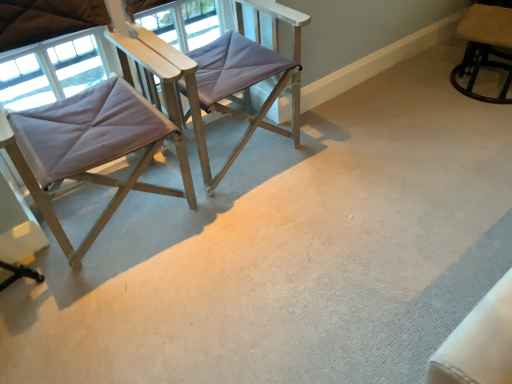
Question: From the image's perspective, is matte purple fabric chair at center, marked as the second chair in a left-to-right arrangement, located beneath beige fabric chair at upper right, which is counted as the 3th chair, starting from the left?

Choices:
 (A) yes
 (B) no

Answer: (A)

Question: Could beige fabric chair at upper right, which is counted as the 3th chair, starting from the left, be considered to be inside matte purple fabric chair at center, marked as the 2th chair in a right-to-left arrangement?

Choices:
 (A) no
 (B) yes

Answer: (A)

Question: From a real-world perspective, does matte purple fabric chair at center, marked as the 2th chair in a right-to-left arrangement, stand above beige fabric chair at upper right, which is counted as the 3th chair, starting from the left?

Choices:
 (A) yes
 (B) no

Answer: (A)

Question: Considering the relative sizes of matte purple fabric chair at center, marked as the 2th chair in a right-to-left arrangement, and beige fabric chair at upper right, which is counted as the 3th chair, starting from the left, in the image provided, is matte purple fabric chair at center, marked as the 2th chair in a right-to-left arrangement, bigger than beige fabric chair at upper right, which is counted as the 3th chair, starting from the left,?

Choices:
 (A) no
 (B) yes

Answer: (B)

Question: Considering the relative sizes of matte purple fabric chair at center, marked as the second chair in a left-to-right arrangement, and beige fabric chair at upper right, the first chair when ordered from right to left, in the image provided, is matte purple fabric chair at center, marked as the second chair in a left-to-right arrangement, wider than beige fabric chair at upper right, the first chair when ordered from right to left,?

Choices:
 (A) no
 (B) yes

Answer: (B)

Question: Is matte purple fabric chair at center, marked as the 2th chair in a right-to-left arrangement, thinner than beige fabric chair at upper right, the first chair when ordered from right to left?

Choices:
 (A) yes
 (B) no

Answer: (B)

Question: From a real-world perspective, is beige fabric chair at upper right, the first chair when ordered from right to left, located higher than matte gray fabric chair at left, marked as the first chair in a left-to-right arrangement?

Choices:
 (A) yes
 (B) no

Answer: (B)

Question: Considering the relative sizes of beige fabric chair at upper right, the first chair when ordered from right to left, and matte gray fabric chair at left, placed as the 3th chair when sorted from right to left, in the image provided, is beige fabric chair at upper right, the first chair when ordered from right to left, shorter than matte gray fabric chair at left, placed as the 3th chair when sorted from right to left,?

Choices:
 (A) no
 (B) yes

Answer: (B)

Question: Does beige fabric chair at upper right, the first chair when ordered from right to left, appear on the left side of matte gray fabric chair at left, marked as the first chair in a left-to-right arrangement?

Choices:
 (A) no
 (B) yes

Answer: (A)

Question: Can you confirm if beige fabric chair at upper right, the first chair when ordered from right to left, is smaller than matte gray fabric chair at left, marked as the first chair in a left-to-right arrangement?

Choices:
 (A) yes
 (B) no

Answer: (A)

Question: From the image's perspective, does beige fabric chair at upper right, which is counted as the 3th chair, starting from the left, appear lower than matte gray fabric chair at left, placed as the 3th chair when sorted from right to left?

Choices:
 (A) yes
 (B) no

Answer: (B)

Question: Is beige fabric chair at upper right, the first chair when ordered from right to left, taller than matte gray fabric chair at left, marked as the first chair in a left-to-right arrangement?

Choices:
 (A) yes
 (B) no

Answer: (B)

Question: Is beige fabric chair at upper right, the first chair when ordered from right to left, behind matte purple fabric chair at center, marked as the 2th chair in a right-to-left arrangement?

Choices:
 (A) yes
 (B) no

Answer: (A)